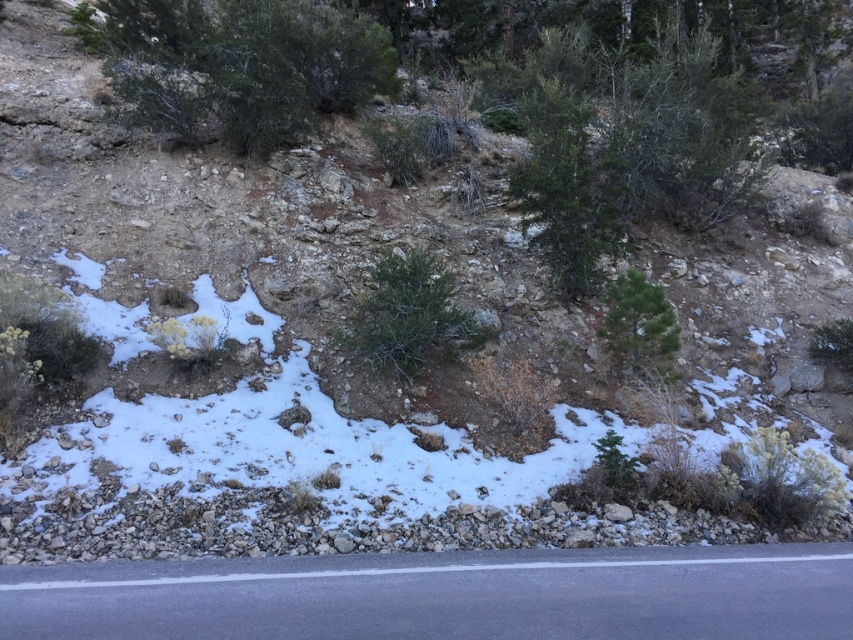
You are a hiker who wants to determine which object is taller between the asphalt at lower center and the green leafy bush at upper left. Based on the scene, which one is taller?

The asphalt at lower center has a lesser height compared to green leafy bush at upper left, so the green leafy bush at upper left is taller.

You are a hiker trying to navigate the terrain. You see the asphalt at lower center and the green leafy tree at upper center. Which object is closer to you?

The asphalt at lower center is closer to you because it is in front of the green leafy tree at upper center.

You are a hiker standing on the road and looking towards the hillside. Which object, the green leafy bush at upper left or the green leafy tree at upper center, is closer to you?

The green leafy bush at upper left is closer to you because it is positioned over the green leafy tree at upper center, indicating it is in a lower plane in the visual perspective.